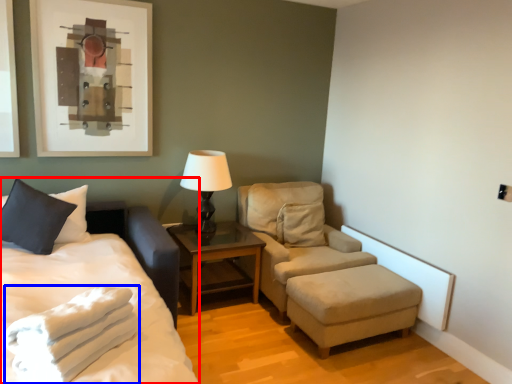
Question: Which point is further to the camera, bed (highlighted by a red box) or blanket (highlighted by a blue box)?

Choices:
 (A) bed
 (B) blanket

Answer: (B)